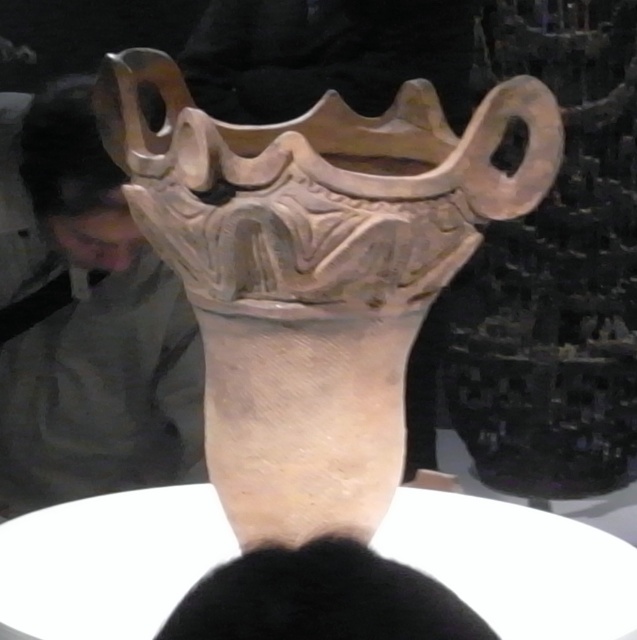
Is matte clay vase at center behind matte gray sculpture at upper left?

No, matte clay vase at center is in front of matte gray sculpture at upper left.

Who is more forward, (315,202) or (192,376)?

Point (315,202) is in front.

The height and width of the screenshot is (640, 637). I want to click on matte clay vase at center, so click(315, 273).

What are the coordinates of `matte clay vase at center` in the screenshot? It's located at (315, 273).